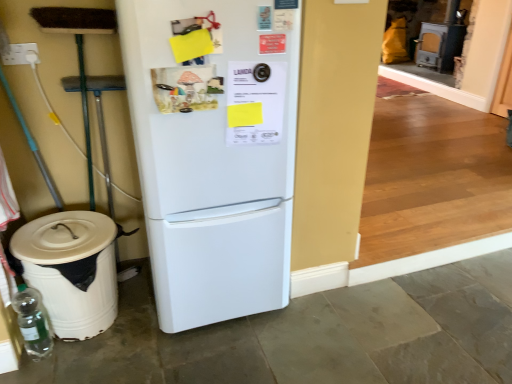
Question: Is transparent glass bottle at lower left a part of white plastic trash bin at lower left?

Choices:
 (A) yes
 (B) no

Answer: (A)

Question: Is white plastic trash bin at lower left not within transparent glass bottle at lower left?

Choices:
 (A) no
 (B) yes

Answer: (B)

Question: Is white plastic trash bin at lower left turned away from transparent glass bottle at lower left?

Choices:
 (A) no
 (B) yes

Answer: (A)

Question: Does white plastic trash bin at lower left come behind transparent glass bottle at lower left?

Choices:
 (A) no
 (B) yes

Answer: (A)

Question: From a real-world perspective, is white plastic trash bin at lower left positioned under transparent glass bottle at lower left based on gravity?

Choices:
 (A) yes
 (B) no

Answer: (B)

Question: Considering the relative sizes of white plastic trash bin at lower left and transparent glass bottle at lower left in the image provided, is white plastic trash bin at lower left taller than transparent glass bottle at lower left?

Choices:
 (A) yes
 (B) no

Answer: (A)

Question: Is transparent glass bottle at lower left smaller than white plastic trash bin at lower left?

Choices:
 (A) no
 (B) yes

Answer: (B)

Question: Is white plastic trash bin at lower left surrounded by transparent glass bottle at lower left?

Choices:
 (A) no
 (B) yes

Answer: (A)

Question: From a real-world perspective, is transparent glass bottle at lower left located beneath white plastic trash bin at lower left?

Choices:
 (A) yes
 (B) no

Answer: (A)

Question: Does transparent glass bottle at lower left have a lesser height compared to white plastic trash bin at lower left?

Choices:
 (A) no
 (B) yes

Answer: (B)

Question: Can you confirm if transparent glass bottle at lower left is positioned to the left of white plastic trash bin at lower left?

Choices:
 (A) yes
 (B) no

Answer: (A)

Question: Does transparent glass bottle at lower left appear on the right side of white plastic trash bin at lower left?

Choices:
 (A) yes
 (B) no

Answer: (B)

Question: From a real-world perspective, is white matte refrigerator at center beneath white plastic trash bin at lower left?

Choices:
 (A) yes
 (B) no

Answer: (B)